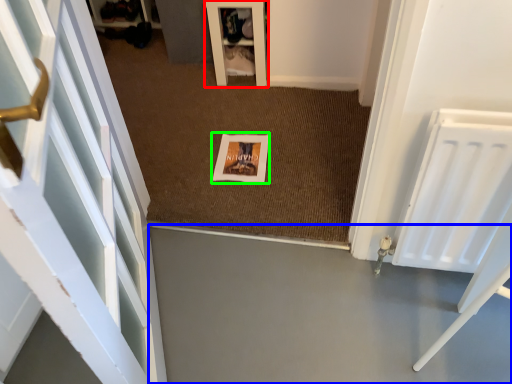
Question: Based on their relative distances, which object is nearer to furniture (highlighted by a red box)? Choose from concrete (highlighted by a blue box) and picture frame (highlighted by a green box).

Choices:
 (A) concrete
 (B) picture frame

Answer: (B)